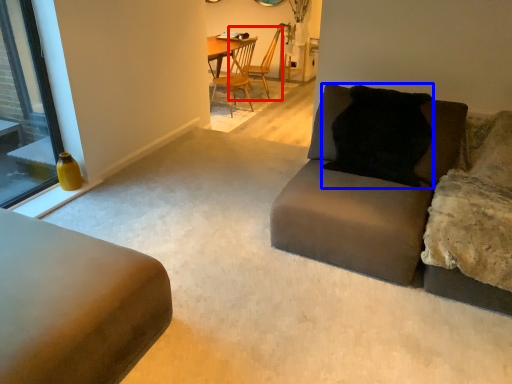
Question: Which of the following is the closest to the observer, chair (highlighted by a red box) or pillow (highlighted by a blue box)?

Choices:
 (A) chair
 (B) pillow

Answer: (B)